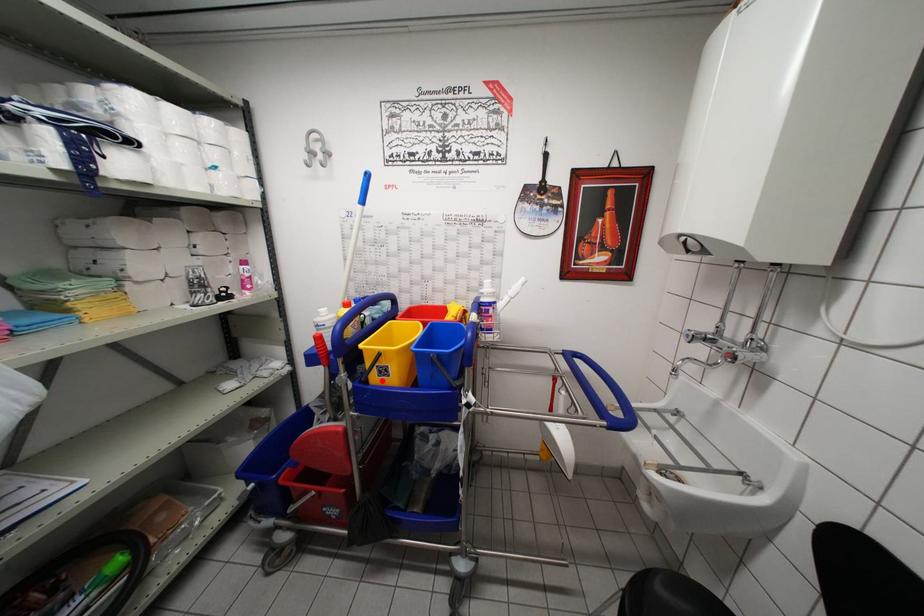
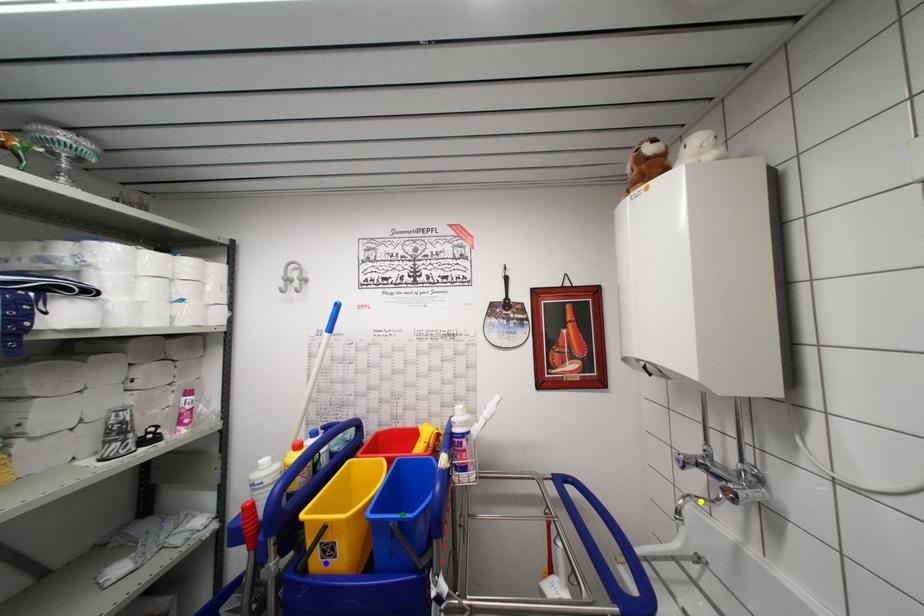
Question: I am providing you with two images of the same scene from different viewpoints. A red point is marked on the first image. You are given multiple points on the second image. Which spot in image 2 lines up with the point in image 1?

Choices:
 (A) green point
 (B) blue point
 (C) yellow point

Answer: (B)